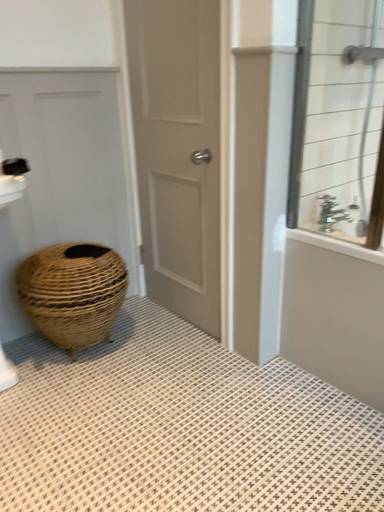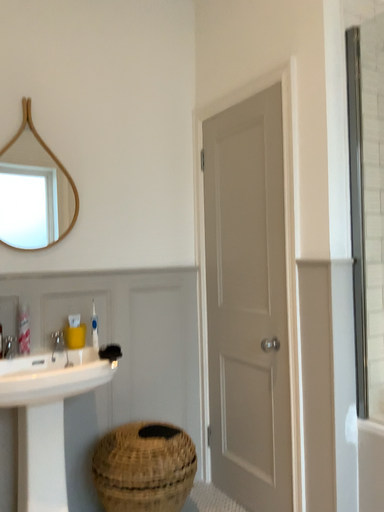
Question: Which way did the camera rotate in the video?

Choices:
 (A) rotated upward
 (B) rotated downward

Answer: (A)